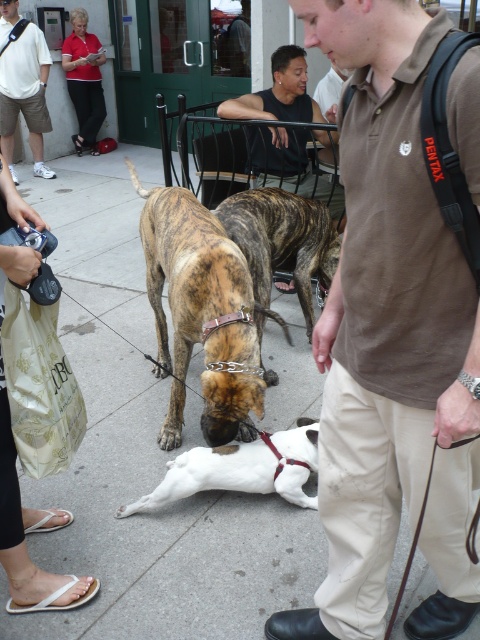
Question: Estimate the real-world distances between objects in this image. Which object is closer to the red shirt at upper left?

Choices:
 (A) matte black shirt at upper left
 (B) white fabric bag at lower left
 (C) brindle fur dog at center

Answer: (A)

Question: Which of the following is the closest to the observer?

Choices:
 (A) (316, 113)
 (B) (255, 198)
 (C) (33, 81)

Answer: (B)

Question: Which of the following is the farthest from the observer?

Choices:
 (A) brindle leather dog at center
 (B) matte black shirt at upper left
 (C) red shirt at upper left
 (D) white matte dog at center

Answer: (C)

Question: Can you confirm if brown cotton shirt at center is positioned to the right of red shirt at upper left?

Choices:
 (A) no
 (B) yes

Answer: (B)

Question: Is brindle fur dog at center closer to camera compared to dark brown leather shirt at center?

Choices:
 (A) yes
 (B) no

Answer: (A)

Question: Can you confirm if brown cotton shirt at center is wider than brindle leather dog at center?

Choices:
 (A) no
 (B) yes

Answer: (A)